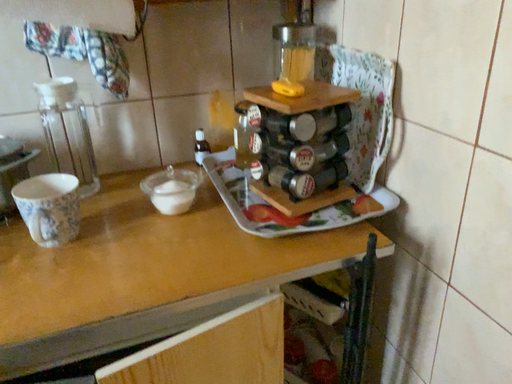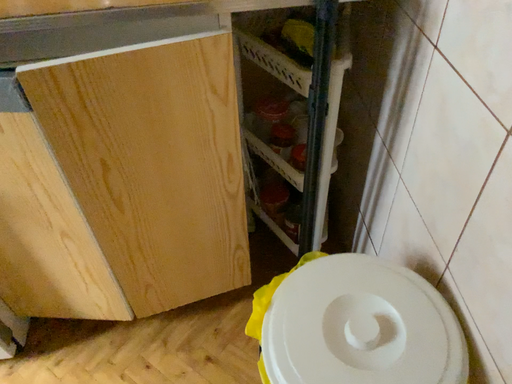
Question: How did the camera likely rotate when shooting the video?

Choices:
 (A) rotated downward
 (B) rotated upward

Answer: (A)